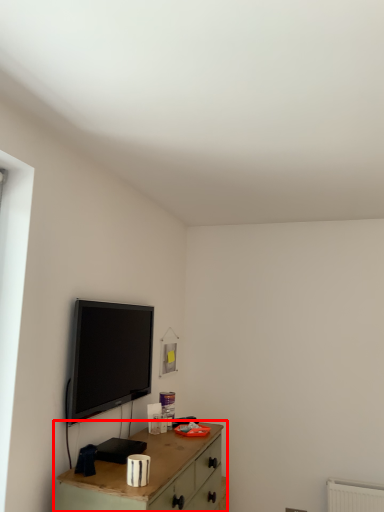
Question: Where is table (annotated by the red box) located in relation to television in the image?

Choices:
 (A) left
 (B) right

Answer: (B)